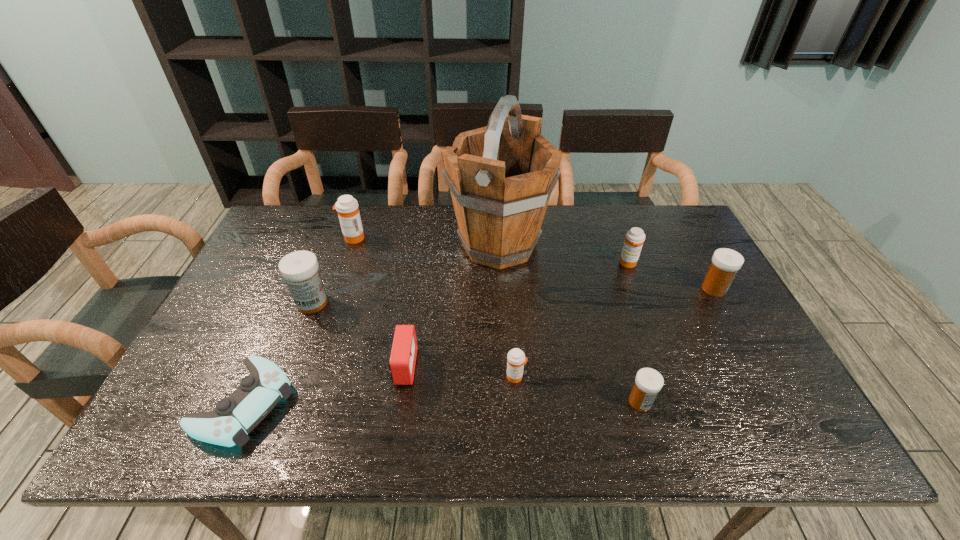
You are a GUI agent. You are given a task and a screenshot of the screen. Output one action in this format:
    pyautogui.click(x=<x>, y=<y>)
    Task: Click on the medicine that can be found as the third closest to the second orange medicine from right to left
    
    Given the screenshot: What is the action you would take?
    pyautogui.click(x=300, y=269)

Point out which white medicine is positioned as the nearest to the second nearest orange medicine. Please provide its 2D coordinates. Your answer should be formatted as a tuple, i.e. [(x, y)], where the tuple contains the x and y coordinates of a point satisfying the conditions above.

[(726, 262)]

This screenshot has height=540, width=960. Identify the location of white medicine that is the closest one to the alarm clock. (300, 269).

Choose which orange medicine is the third nearest neighbor to the shortest object. Please provide its 2D coordinates. Your answer should be formatted as a tuple, i.e. [(x, y)], where the tuple contains the x and y coordinates of a point satisfying the conditions above.

[(635, 237)]

At what (x,y) coordinates should I click in order to perform the action: click on orange medicine object that ranks as the second closest to the second smallest white medicine. Please return your answer as a coordinate pair (x, y). Looking at the image, I should click on (516, 359).

Find the location of a particular element. This screenshot has height=540, width=960. free region that satisfies the following two spatial constraints: 1. on the front-facing side of the red alarm clock; 2. on the right side of the second white medicine from right to left is located at coordinates (399, 402).

Find the location of a particular element. The width and height of the screenshot is (960, 540). free space that satisfies the following two spatial constraints: 1. on the front side of the bucket; 2. on the left side of the rightmost object is located at coordinates (501, 289).